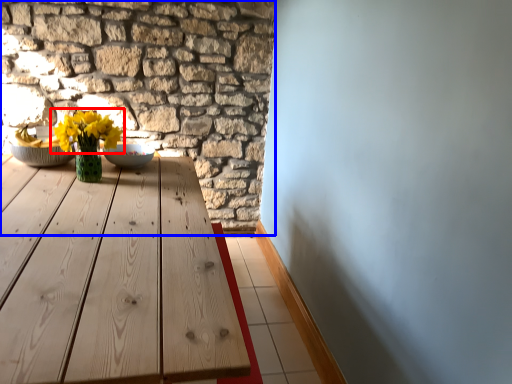
Question: Which object appears farthest to the camera in this image, flower (highlighted by a red box) or brickwork (highlighted by a blue box)?

Choices:
 (A) flower
 (B) brickwork

Answer: (B)